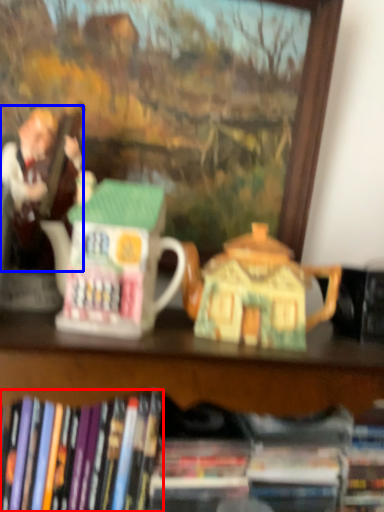
Question: Among these objects, which one is nearest to the camera, book (highlighted by a red box) or person (highlighted by a blue box)?

Choices:
 (A) book
 (B) person

Answer: (A)